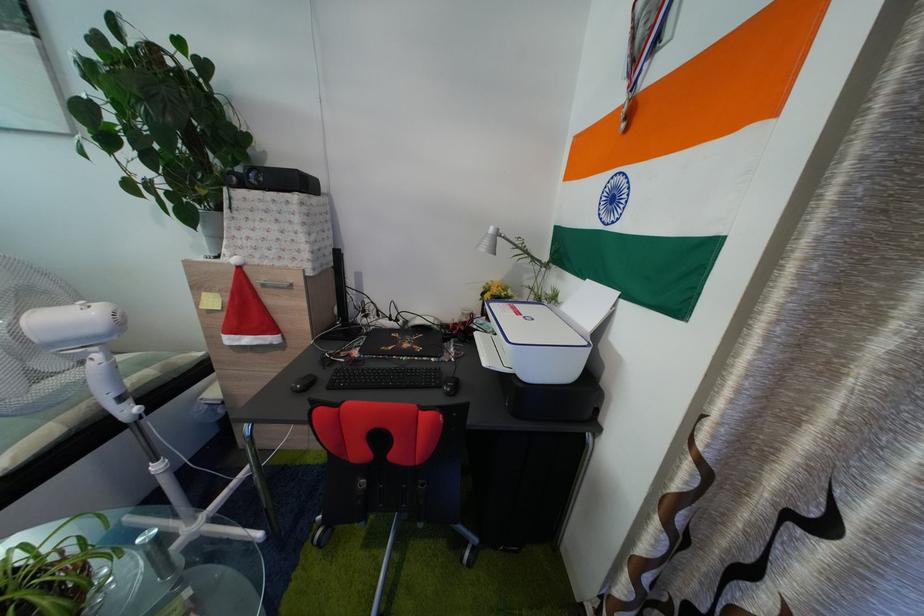
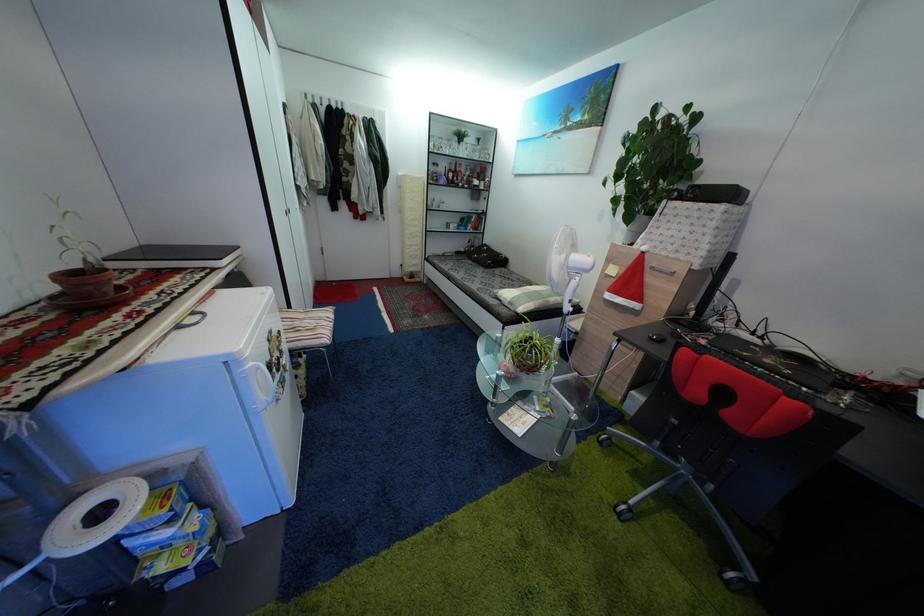
Question: The camera is either moving clockwise (left) or counter-clockwise (right) around the object. The first image is from the beginning of the video and the second image is from the end. Is the camera moving left or right when shooting the video?

Choices:
 (A) Left
 (B) Right

Answer: (B)